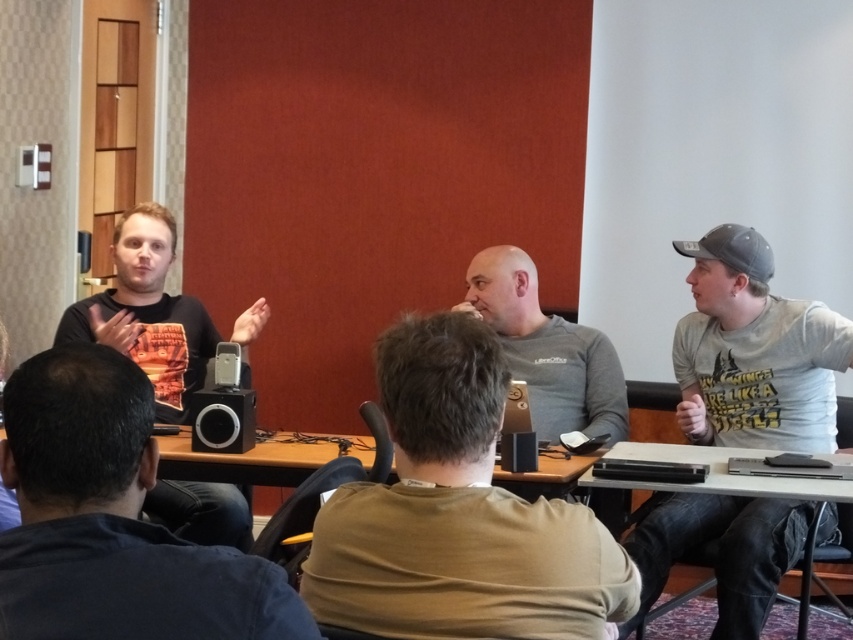
Does black plastic table at lower center have a lesser width compared to satin black speaker at center?

No.

Which of these two, black plastic table at lower center or satin black speaker at center, stands taller?

satin black speaker at center is taller.

At what (x,y) coordinates should I click in order to perform the action: click on black plastic table at lower center. Please return your answer as a coordinate pair (x, y). Looking at the image, I should click on (242, 461).

Between point (12, 632) and point (518, 458), which one is positioned in front?

Point (12, 632) is more forward.

Based on the photo, who is higher up, matte black laptop at left or black matte laptop at center?

matte black laptop at left is above.

Who is more distant from viewer, [142,637] or [523,440]?

Positioned behind is point [523,440].

Where is `matte black laptop at left`? matte black laptop at left is located at coordinates (112, 520).

Between gray matte shirt at center and black plastic table at lower right, which one has more height?

Standing taller between the two is gray matte shirt at center.

Can you confirm if gray matte shirt at center is positioned to the right of black plastic table at lower right?

In fact, gray matte shirt at center is to the left of black plastic table at lower right.

Which is behind, point (515, 316) or point (846, 496)?

Positioned behind is point (515, 316).

Where is `gray matte shirt at center`? gray matte shirt at center is located at coordinates (547, 349).